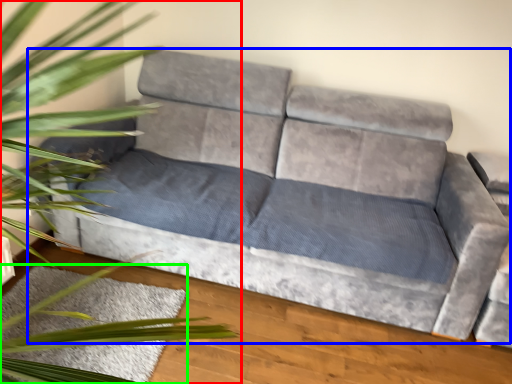
Question: Which is farther away from houseplant (highlighted by a red box)? studio couch (highlighted by a blue box) or mat (highlighted by a green box)?

Choices:
 (A) studio couch
 (B) mat

Answer: (A)